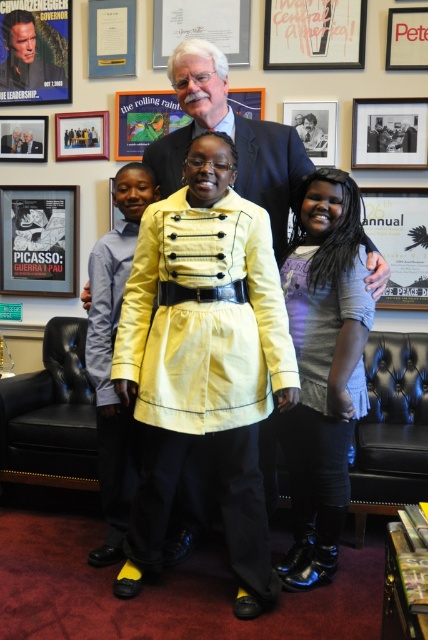
Locate an element on the screen. metallic poster at upper left is located at coordinates (x=35, y=51).

Identify the location of metallic poster at upper left. The width and height of the screenshot is (428, 640). (35, 51).

From the picture: Does yellow fabric jacket at center have a lesser height compared to matte red picture frame at upper right?

Incorrect, yellow fabric jacket at center's height does not fall short of matte red picture frame at upper right's.

You are a GUI agent. You are given a task and a screenshot of the screen. Output one action in this format:
    pyautogui.click(x=<x>, y=<y>)
    Task: Click on the yellow fabric jacket at center
    This screenshot has width=428, height=640.
    Given the screenshot: What is the action you would take?
    pyautogui.click(x=231, y=138)

Describe the element at coordinates (204, 317) in the screenshot. I see `yellow fabric dress at center` at that location.

Measure the distance between yellow fabric dress at center and camera.

The distance of yellow fabric dress at center from camera is 6.11 feet.

Between point (163, 355) and point (261, 129), which one is positioned behind?

Positioned behind is point (261, 129).

The width and height of the screenshot is (428, 640). I want to click on yellow fabric dress at center, so coord(204,317).